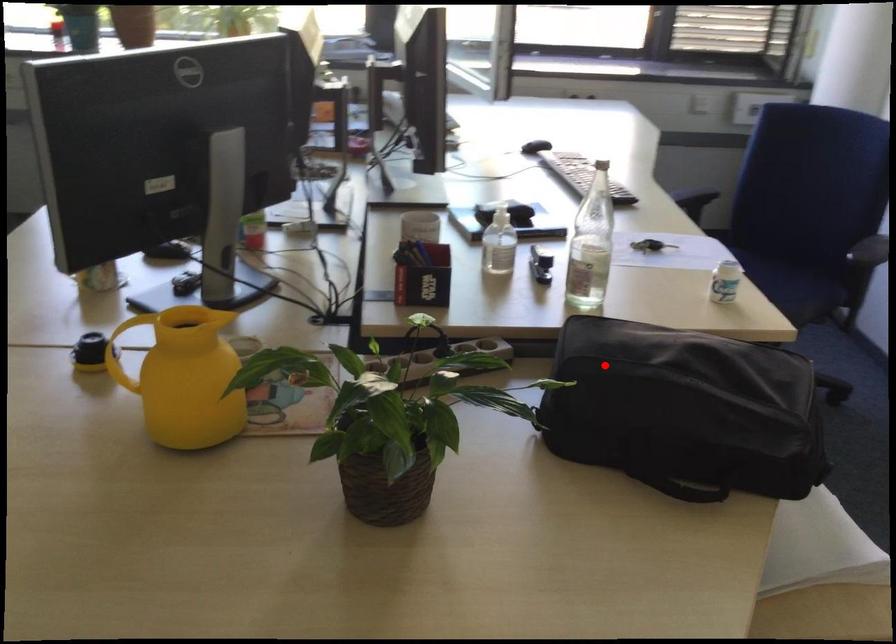
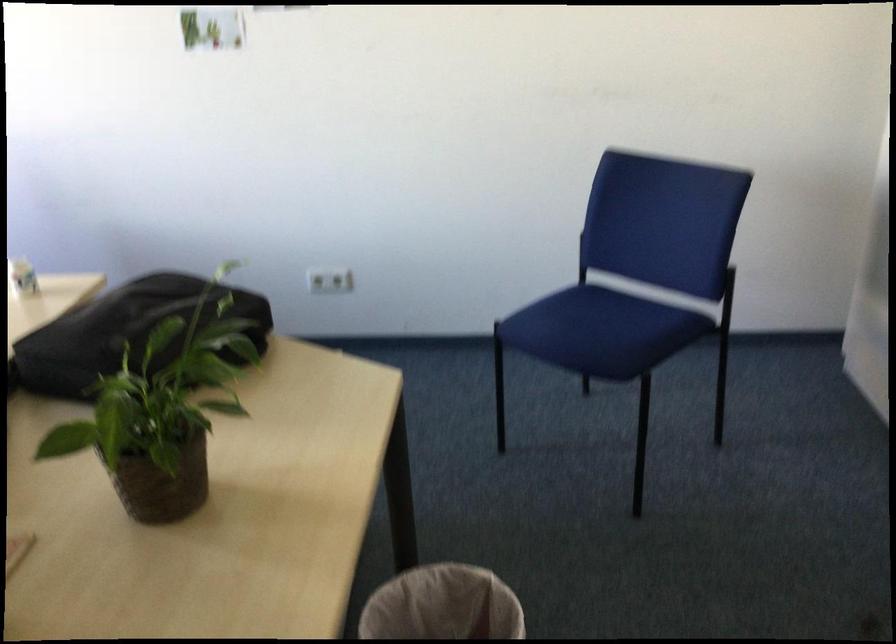
Where in the second image is the point corresponding to the highlighted location from the first image?

(125, 333)